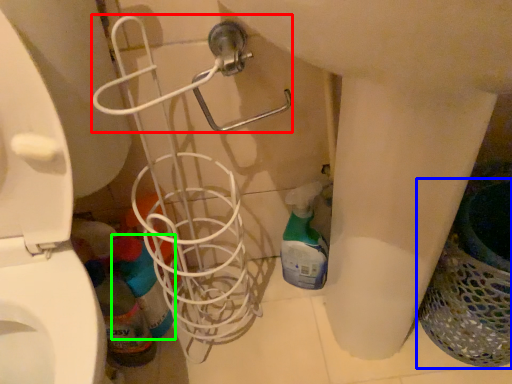
Question: Considering the real-world distances, which object is closest to shower (highlighted by a red box)? laundry basket (highlighted by a blue box) or cleaning product (highlighted by a green box).

Choices:
 (A) laundry basket
 (B) cleaning product

Answer: (B)